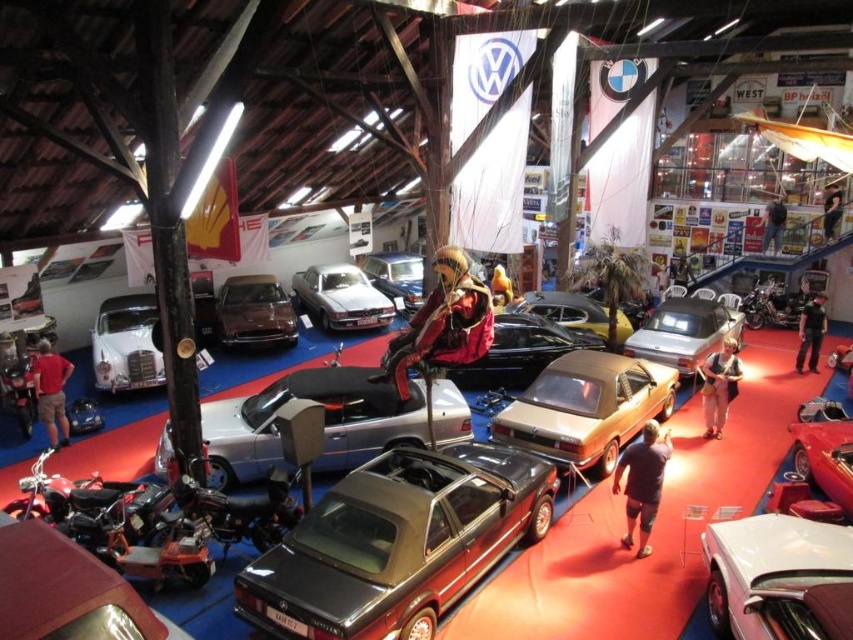
Which is behind, point (648, 572) or point (720, 582)?

The point (648, 572) is behind.

Measure the distance between metallic silver car at center and camera.

metallic silver car at center is 22.57 feet from camera.

Between point (561, 636) and point (798, 602), which one is positioned behind?

Positioned behind is point (561, 636).

At what (x,y) coordinates should I click in order to perform the action: click on metallic silver car at center. Please return your answer as a coordinate pair (x, y). This screenshot has height=640, width=853. Looking at the image, I should click on (656, 524).

Is silver metallic convertible at center above shiny silver car at left?

Incorrect, silver metallic convertible at center is not positioned above shiny silver car at left.

The height and width of the screenshot is (640, 853). What are the coordinates of `silver metallic convertible at center` in the screenshot? It's located at click(x=323, y=422).

Does metallic silver car at center have a smaller size compared to shiny metallic motorcycle at lower left?

No.

Is point (165, 609) less distant than point (108, 625)?

No, (165, 609) is behind (108, 625).

You are a GUI agent. You are given a task and a screenshot of the screen. Output one action in this format:
    pyautogui.click(x=<x>, y=<y>)
    Task: Click on the metallic silver car at center
    Image resolution: width=853 pixels, height=640 pixels.
    Given the screenshot: What is the action you would take?
    pyautogui.click(x=656, y=524)